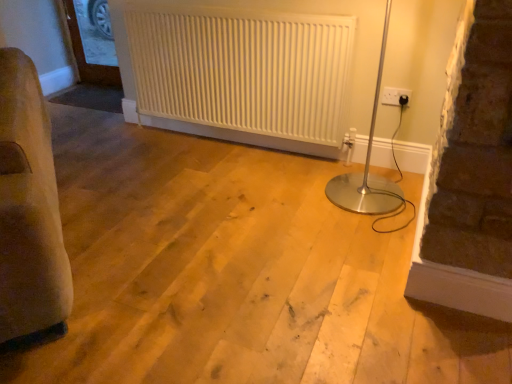
Question: In terms of size, does clear glass door at upper left appear bigger or smaller than white plastic electric outlet at upper right?

Choices:
 (A) small
 (B) big

Answer: (B)

Question: Is clear glass door at upper left spatially inside white plastic electric outlet at upper right, or outside of it?

Choices:
 (A) inside
 (B) outside

Answer: (B)

Question: Based on their relative distances, which object is farther from the clear glass door at upper left?

Choices:
 (A) white plastic electric outlet at upper right
 (B) white textured radiator at center

Answer: (A)

Question: Estimate the real-world distances between objects in this image. Which object is farther from the clear glass door at upper left?

Choices:
 (A) white textured radiator at center
 (B) white plastic electric outlet at upper right

Answer: (B)